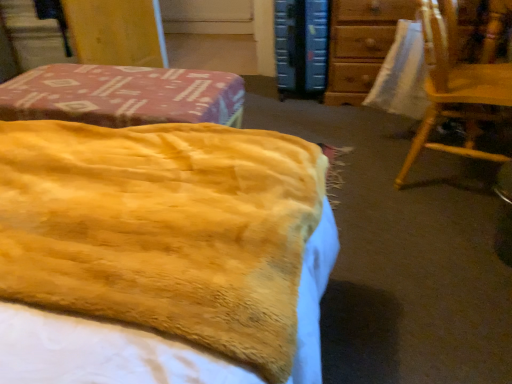
Question: Is wooden chair at right taller or shorter than wooden chair at upper right?

Choices:
 (A) tall
 (B) short

Answer: (A)

Question: Would you say wooden chair at right is inside or outside wooden chair at upper right?

Choices:
 (A) outside
 (B) inside

Answer: (A)

Question: Considering the real-world distances, which object is closest to the blue hardcover book at upper center?

Choices:
 (A) wooden chair at right
 (B) wooden chair at upper right
 (C) yellow plush blanket at center

Answer: (B)

Question: Based on their relative distances, which object is farther from the yellow plush blanket at center?

Choices:
 (A) blue hardcover book at upper center
 (B) wooden chair at upper right
 (C) wooden chair at right

Answer: (A)